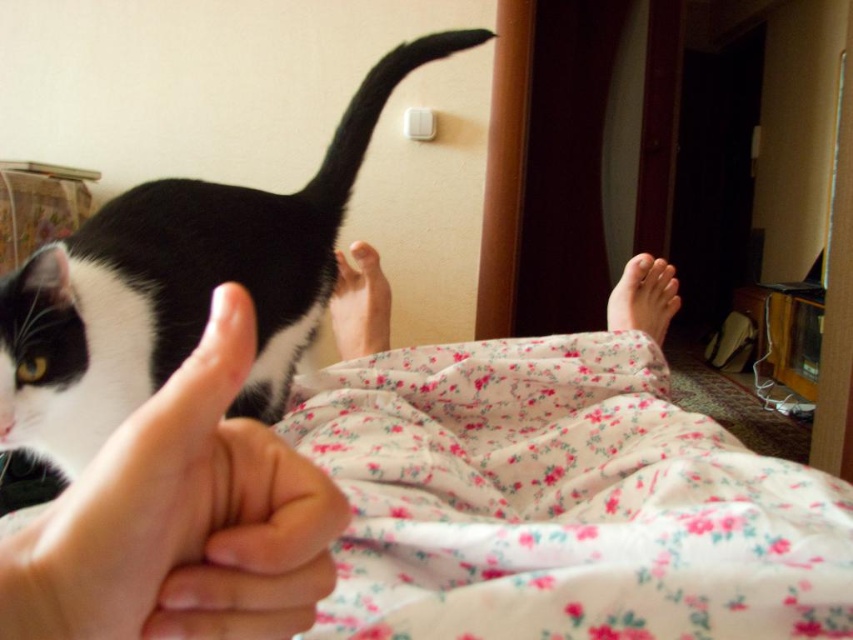
In the scene shown: Who is positioned more to the left, white matte hand at lower left or pink floral fabric at lower right?

Positioned to the left is white matte hand at lower left.

Can you confirm if white matte hand at lower left is positioned to the right of pink floral fabric at lower right?

No, white matte hand at lower left is not to the right of pink floral fabric at lower right.

Is point (193, 404) positioned before point (628, 280)?

Yes, point (193, 404) is closer to viewer.

This screenshot has width=853, height=640. What are the coordinates of `white matte hand at lower left` in the screenshot? It's located at (181, 518).

Does floral cotton blanket at lower center appear under pink soft skin at center?

Yes.

Does floral cotton blanket at lower center have a larger size compared to pink soft skin at center?

Indeed, floral cotton blanket at lower center has a larger size compared to pink soft skin at center.

Consider the image. Who is more distant from viewer, (354, 452) or (335, 336)?

The point (335, 336) is behind.

This screenshot has width=853, height=640. What are the coordinates of `floral cotton blanket at lower center` in the screenshot? It's located at (561, 502).

Which is more to the left, floral cotton blanket at lower center or white matte hand at lower left?

From the viewer's perspective, white matte hand at lower left appears more on the left side.

Is floral cotton blanket at lower center behind white matte hand at lower left?

Yes.

Locate an element on the screen. floral cotton blanket at lower center is located at coordinates (561, 502).

Image resolution: width=853 pixels, height=640 pixels. I want to click on floral cotton blanket at lower center, so click(561, 502).